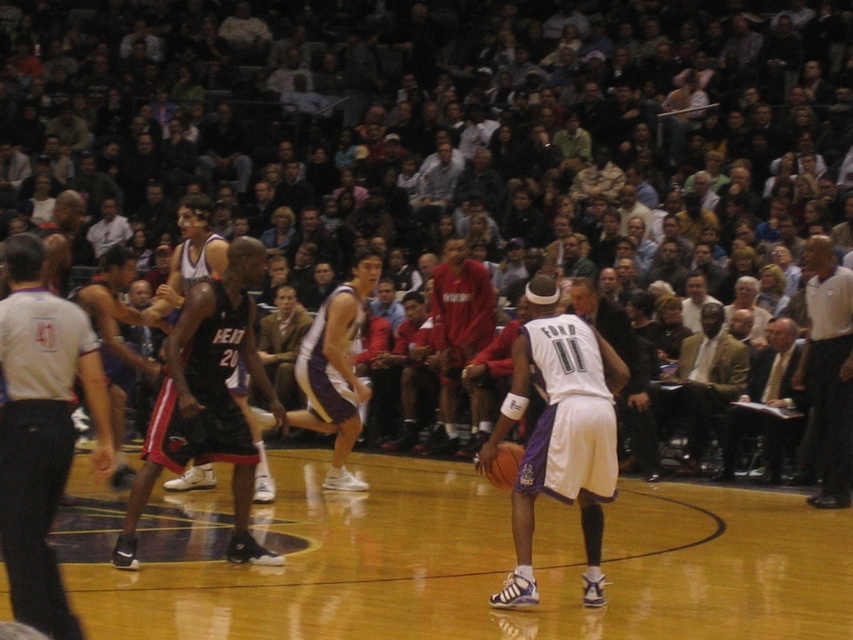
Question: Does white matte jersey at center have a lesser width compared to shiny orange basketball at center?

Choices:
 (A) no
 (B) yes

Answer: (A)

Question: Which object is positioned closest to the shiny orange basketball at center?

Choices:
 (A) light brown suit jacket at right
 (B) dark clothing crowd at center
 (C) white shirt at upper right
 (D) red jersey at center

Answer: (C)

Question: Which object is farther from the camera taking this photo?

Choices:
 (A) red jersey at center
 (B) white matte jersey at center
 (C) white shirt at upper right
 (D) dark clothing crowd at center

Answer: (A)

Question: Is glossy wood basketball court at center thinner than black jersey at center?

Choices:
 (A) no
 (B) yes

Answer: (B)

Question: Which object is positioned farthest from the dark clothing crowd at center?

Choices:
 (A) light brown suit jacket at right
 (B) glossy wood basketball court at center

Answer: (B)

Question: Does white shirt at upper right have a smaller size compared to light brown suit jacket at right?

Choices:
 (A) yes
 (B) no

Answer: (B)